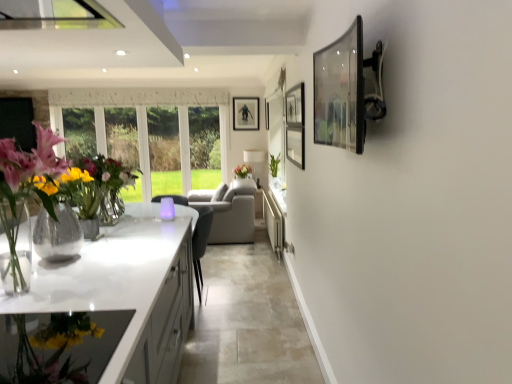
In order to face matte black picture frame at upper center, arranged as the second picture frame when viewed from the back, should I rotate leftwards or rightwards?

To align with it, rotate right about 1.382°.

This screenshot has height=384, width=512. Describe the element at coordinates (111, 275) in the screenshot. I see `white glossy countertop at lower left` at that location.

What do you see at coordinates (245, 113) in the screenshot? I see `matte black picture frame at upper center, arranged as the third picture frame when viewed from the right` at bounding box center [245, 113].

At what (x,y) coordinates should I click in order to perform the action: click on translucent glass vase at left. Please return your answer as a coordinate pair (x, y). The width and height of the screenshot is (512, 384). Looking at the image, I should click on (25, 199).

Where is `green glossy plant at center`? The image size is (512, 384). green glossy plant at center is located at coordinates (274, 164).

Image resolution: width=512 pixels, height=384 pixels. I want to click on matte black picture frame at upper center, which is the second picture frame in top-to-bottom order, so click(267, 115).

Find the location of a particular element. picture frame on the right of white glossy cabinetry at center is located at coordinates (340, 91).

Is point (266, 205) closer or farther from the camera than point (322, 104)?

Clearly, point (266, 205) is more distant from the camera than point (322, 104).

Is clear glass picture frame at upper right, placed as the third picture frame when sorted from back to front, surrounded by white glossy cabinetry at center?

Actually, clear glass picture frame at upper right, placed as the third picture frame when sorted from back to front, is outside white glossy cabinetry at center.

Is green glossy plant at center at the left side of translucent glass vase at left?

Incorrect, green glossy plant at center is not on the left side of translucent glass vase at left.

The width and height of the screenshot is (512, 384). Identify the location of plant above the translucent glass vase at left (from the image's perspective). (274, 164).

Is green glossy plant at center oriented towards translucent glass vase at left?

No, green glossy plant at center is not oriented towards translucent glass vase at left.

From the image's perspective, is green glossy plant at center beneath translucent glass vase at left?

No, from the image's perspective, green glossy plant at center is not beneath translucent glass vase at left.

Looking at this image, between matte black picture frame at upper center, the third picture frame in the bottom-to-top sequence, and pink matte flower at center, which one appears on the right side from the viewer's perspective?

Positioned to the right is matte black picture frame at upper center, the third picture frame in the bottom-to-top sequence.

Is matte black picture frame at upper center, the third picture frame when ordered from front to back, inside or outside of pink matte flower at center?

matte black picture frame at upper center, the third picture frame when ordered from front to back, is outside pink matte flower at center.

Does point (234, 112) come closer to viewer compared to point (250, 169)?

Yes, it is.

How many degrees apart are the facing directions of matte black picture frame at upper center, arranged as the third picture frame when viewed from the right, and pink matte flower at center?

The facing directions of matte black picture frame at upper center, arranged as the third picture frame when viewed from the right, and pink matte flower at center are 90 degrees apart.

Relative to translucent glass vase at left, is matte black picture frame at upper center, the third picture frame in the bottom-to-top sequence, in front or behind?

In the image, matte black picture frame at upper center, the third picture frame in the bottom-to-top sequence, appears behind translucent glass vase at left.

Which is more distant, (238, 129) or (68, 255)?

Point (238, 129)

Are matte black picture frame at upper center, which ranks as the first picture frame in left-to-right order, and translucent glass vase at left far apart?

Yes, matte black picture frame at upper center, which ranks as the first picture frame in left-to-right order, and translucent glass vase at left are located far from each other.

From a real-world perspective, which object rests below the other?

translucent glass vase at left is physically lower.

Which of these two, matte black picture frame at upper center, the 2th picture frame viewed from the front, or clear glass picture frame at upper right, the 3th picture frame viewed from the left, is bigger?

With larger size is clear glass picture frame at upper right, the 3th picture frame viewed from the left.

Does matte black picture frame at upper center, arranged as the 2th picture frame when viewed from the right, touch clear glass picture frame at upper right, the 3th picture frame viewed from the left?

No, matte black picture frame at upper center, arranged as the 2th picture frame when viewed from the right, is not with clear glass picture frame at upper right, the 3th picture frame viewed from the left.

From a real-world perspective, is matte black picture frame at upper center, the second picture frame viewed from the left, positioned above or below clear glass picture frame at upper right, placed as the third picture frame when sorted from back to front?

In terms of real-world spatial position, matte black picture frame at upper center, the second picture frame viewed from the left, is above clear glass picture frame at upper right, placed as the third picture frame when sorted from back to front.

Is matte black picture frame at upper center, marked as the second picture frame in a bottom-to-top arrangement, closer to the viewer compared to clear glass picture frame at upper right, the 3th picture frame viewed from the left?

No, matte black picture frame at upper center, marked as the second picture frame in a bottom-to-top arrangement, is further to the viewer.

Would you say matte black picture frame at upper center, arranged as the second picture frame when viewed from the back, is to the left or to the right of green glossy plant at center in the picture?

Clearly, matte black picture frame at upper center, arranged as the second picture frame when viewed from the back, is on the left of green glossy plant at center in the image.

Is matte black picture frame at upper center, marked as the second picture frame in a bottom-to-top arrangement, further to camera compared to green glossy plant at center?

Yes.

From the picture: Is matte black picture frame at upper center, which is the second picture frame in top-to-bottom order, oriented away from green glossy plant at center?

No, green glossy plant at center is not at the back of matte black picture frame at upper center, which is the second picture frame in top-to-bottom order.

Can you confirm if matte black picture frame at upper center, arranged as the second picture frame when viewed from the back, is wider than green glossy plant at center?

No.

Which of these two, white glossy cabinetry at center or white glossy countertop at lower left, is smaller?

With smaller size is white glossy cabinetry at center.

From a real-world perspective, is white glossy cabinetry at center positioned above or below white glossy countertop at lower left?

From a real-world perspective, white glossy cabinetry at center is physically above white glossy countertop at lower left.

Which of these two, white glossy cabinetry at center or white glossy countertop at lower left, stands shorter?

With less height is white glossy countertop at lower left.

Find the location of a particular element. the 1st picture frame above the white glossy cabinetry at center (from a real-world perspective) is located at coordinates (340, 91).

Image resolution: width=512 pixels, height=384 pixels. Identify the location of plant located above the translucent glass vase at left (from the image's perspective). (274, 164).

Which object lies further to the anchor point white glossy cabinetry at center, clear glass picture frame at upper right, arranged as the 1th picture frame when viewed from the front, or white glossy countertop at lower left?

clear glass picture frame at upper right, arranged as the 1th picture frame when viewed from the front.

Which object lies further to the anchor point white glossy cabinetry at center, clear glass picture frame at upper right, placed as the third picture frame when sorted from back to front, or pink matte flower at center?

Based on the image, clear glass picture frame at upper right, placed as the third picture frame when sorted from back to front, appears to be further to white glossy cabinetry at center.

Estimate the real-world distances between objects in this image. Which object is further from pink matte flower at center, white glossy cabinetry at center or translucent glass vase at left?

Based on the image, translucent glass vase at left appears to be further to pink matte flower at center.

Which object lies nearer to the anchor point matte black picture frame at upper center, the 2th picture frame viewed from the front, green glossy plant at center or clear glass picture frame at upper right, placed as the third picture frame when sorted from back to front?

green glossy plant at center lies closer to matte black picture frame at upper center, the 2th picture frame viewed from the front, than the other object.

Considering their positions, is matte black picture frame at upper center, the third picture frame when ordered from front to back, positioned closer to green glossy plant at center than white glossy countertop at lower left?

matte black picture frame at upper center, the third picture frame when ordered from front to back.

From the image, which object appears to be farther from matte black picture frame at upper center, the 2th picture frame viewed from the front, translucent glass vase at left or white glossy countertop at lower left?

translucent glass vase at left.

From the image, which object appears to be farther from white glossy countertop at lower left, white glossy cabinetry at center or pink matte flower at center?

pink matte flower at center.

Based on their spatial positions, is white glossy countertop at lower left or white glossy cabinetry at center further from clear glass picture frame at upper right, which ranks as the 1th picture frame in right-to-left order?

Among the two, white glossy cabinetry at center is located further to clear glass picture frame at upper right, which ranks as the 1th picture frame in right-to-left order.

Where is `plant between translucent glass vase at left and matte black picture frame at upper center, arranged as the second picture frame when viewed from the back, along the z-axis`? plant between translucent glass vase at left and matte black picture frame at upper center, arranged as the second picture frame when viewed from the back, along the z-axis is located at coordinates (274, 164).

The width and height of the screenshot is (512, 384). I want to click on countertop between clear glass picture frame at upper right, the 3th picture frame viewed from the left, and green glossy plant at center in the front-back direction, so click(x=111, y=275).

This screenshot has width=512, height=384. Find the location of `cabinetry positioned between white glossy countertop at lower left and pink matte flower at center from near to far`. cabinetry positioned between white glossy countertop at lower left and pink matte flower at center from near to far is located at coordinates (273, 223).

At what (x,y) coordinates should I click in order to perform the action: click on cabinetry between white glossy countertop at lower left and green glossy plant at center from front to back. Please return your answer as a coordinate pair (x, y). Looking at the image, I should click on (273, 223).